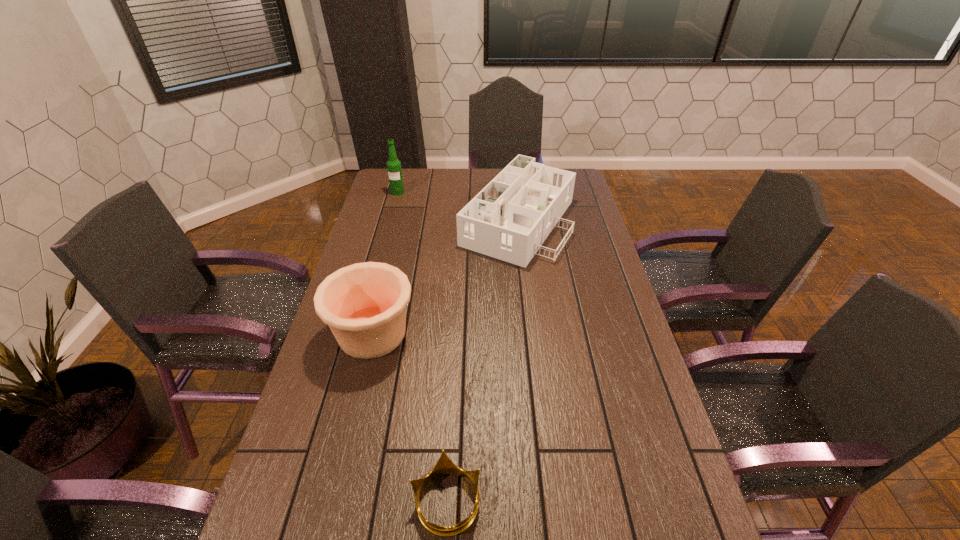
What are the coordinates of `free space at the far left corner of the desktop` in the screenshot? It's located at (383, 192).

At what (x,y) coordinates should I click in order to perform the action: click on vacant space at the far right corner of the desktop. Please return your answer as a coordinate pair (x, y). The height and width of the screenshot is (540, 960). Looking at the image, I should click on (584, 192).

Image resolution: width=960 pixels, height=540 pixels. In order to click on free space between the crown and the third tallest object in this screenshot , I will do `click(482, 360)`.

Where is `vacant space in between the crown and the second tallest object`? This screenshot has height=540, width=960. vacant space in between the crown and the second tallest object is located at coordinates (409, 417).

The width and height of the screenshot is (960, 540). I want to click on vacant space in between the pottery and the beer bottle, so click(x=385, y=263).

I want to click on free point between the tallest object and the second tallest object, so click(385, 263).

The height and width of the screenshot is (540, 960). In order to click on blank region between the crown and the tallest object in this screenshot , I will do `click(422, 347)`.

Find the location of a particular element. vacant space that is in between the dollhouse and the nearest object is located at coordinates (482, 360).

This screenshot has height=540, width=960. What are the coordinates of `blank region between the nearest object and the third shortest object` in the screenshot? It's located at (409, 417).

This screenshot has height=540, width=960. I want to click on vacant point located between the crown and the second nearest object, so click(x=409, y=417).